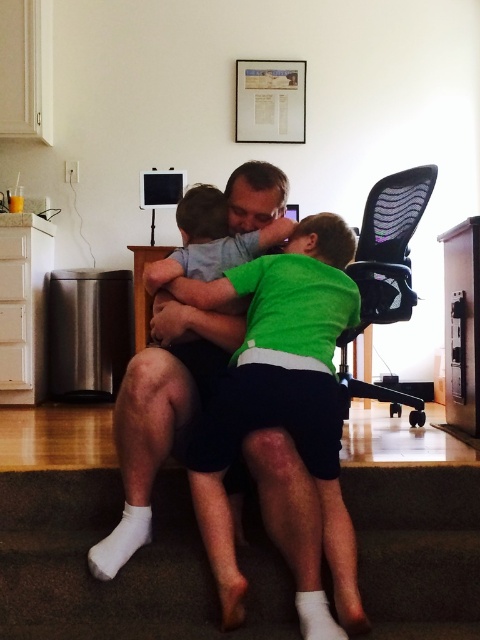
Question: Is smooth skin man at center above black mesh swivel chair at right?

Choices:
 (A) no
 (B) yes

Answer: (A)

Question: Which point appears closest to the camera in this image?

Choices:
 (A) (123, 388)
 (B) (422, 177)

Answer: (A)

Question: Does smooth skin man at center appear on the left side of black mesh swivel chair at right?

Choices:
 (A) yes
 (B) no

Answer: (A)

Question: Does smooth skin man at center have a smaller size compared to black mesh swivel chair at right?

Choices:
 (A) no
 (B) yes

Answer: (B)

Question: Which object is closer to the camera taking this photo?

Choices:
 (A) smooth skin man at center
 (B) black mesh swivel chair at right

Answer: (A)